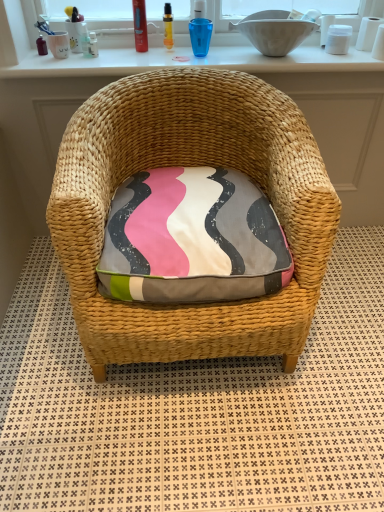
Where is `vacant space to the right of translucent plastic toothbrush at upper center, the 1th toiletry from the left`? vacant space to the right of translucent plastic toothbrush at upper center, the 1th toiletry from the left is located at coordinates (129, 58).